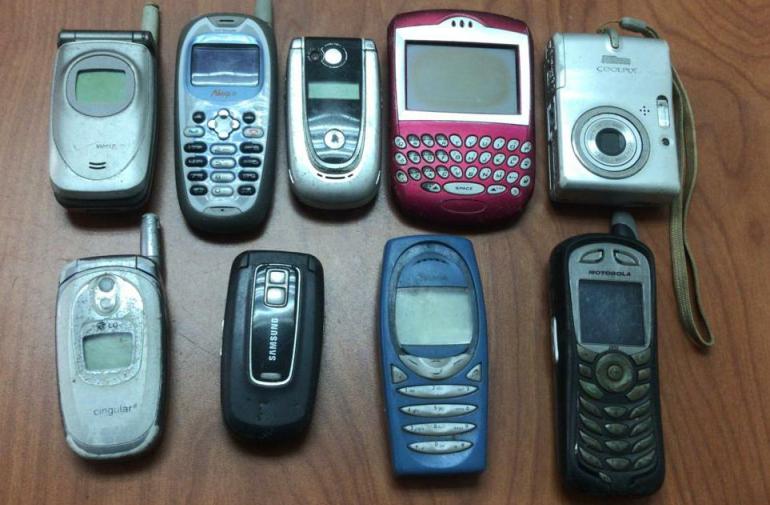
This screenshot has width=770, height=505. I want to click on phone, so click(597, 328), click(423, 324), click(444, 106), click(319, 93), click(283, 294), click(213, 110), click(98, 133), click(119, 328).